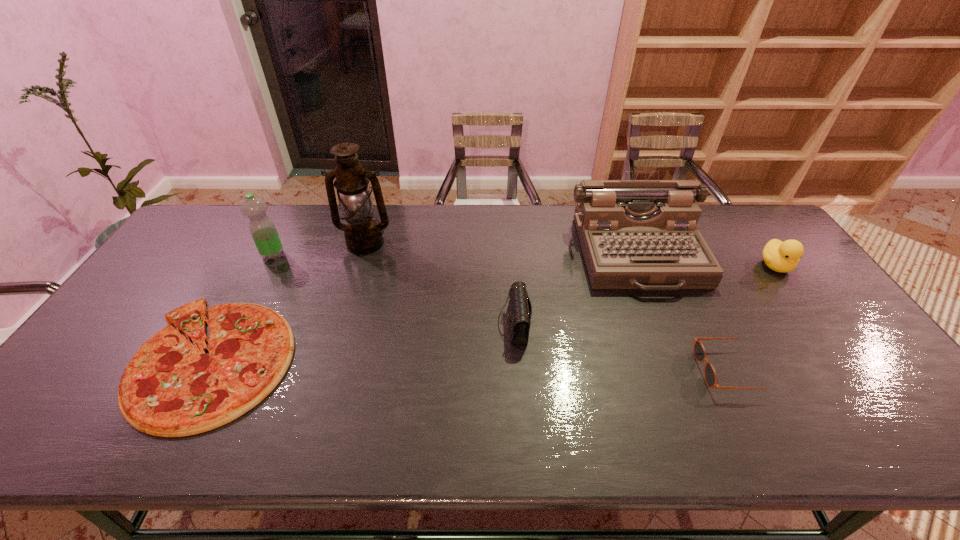
Identify the location of vacant space located 0.110m on the right of the oil lamp. (425, 244).

Image resolution: width=960 pixels, height=540 pixels. I want to click on vacant region located 0.230m on the left of the water bottle, so click(190, 255).

At what (x,y) coordinates should I click in order to perform the action: click on vacant area situated 0.180m on the keyboard of the typewriter. Please return your answer as a coordinate pair (x, y). Looking at the image, I should click on (677, 348).

At what (x,y) coordinates should I click in order to perform the action: click on free region located on the front-facing side of the duck. Please return your answer as a coordinate pair (x, y). The image size is (960, 540). Looking at the image, I should click on (863, 385).

Locate an element on the screen. The width and height of the screenshot is (960, 540). vacant space situated 0.100m on the front flap of the fourth object from left to right is located at coordinates (461, 325).

At what (x,y) coordinates should I click in order to perform the action: click on free space located 0.310m on the front flap of the fourth object from left to right. Please return your answer as a coordinate pair (x, y). The width and height of the screenshot is (960, 540). Looking at the image, I should click on (384, 325).

Identify the location of free space located on the front flap of the fourth object from left to right. The image size is (960, 540). tap(358, 325).

Identify the location of vacant space located 0.270m on the front-facing side of the second shortest object. The height and width of the screenshot is (540, 960). (590, 370).

Where is `vacant space situated 0.330m on the front-facing side of the second shortest object`? This screenshot has height=540, width=960. vacant space situated 0.330m on the front-facing side of the second shortest object is located at coordinates (566, 370).

Locate an element on the screen. vacant space located on the front-facing side of the second shortest object is located at coordinates click(x=550, y=370).